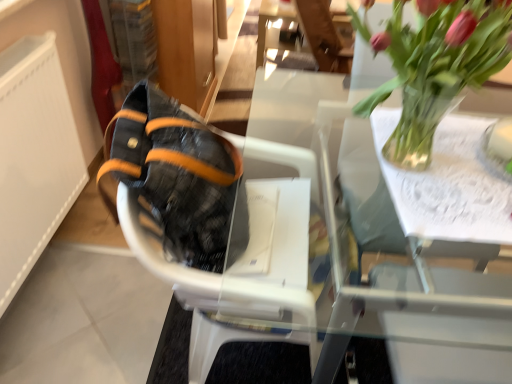
Question: Can we say leather-like black shoe at left lies outside black textured fabric baby carriage at center?

Choices:
 (A) yes
 (B) no

Answer: (B)

Question: Is leather-like black shoe at left to the right of black textured fabric baby carriage at center from the viewer's perspective?

Choices:
 (A) no
 (B) yes

Answer: (A)

Question: Is leather-like black shoe at left next to black textured fabric baby carriage at center?

Choices:
 (A) yes
 (B) no

Answer: (A)

Question: From a real-world perspective, is leather-like black shoe at left located higher than black textured fabric baby carriage at center?

Choices:
 (A) yes
 (B) no

Answer: (A)

Question: Is the depth of leather-like black shoe at left greater than that of black textured fabric baby carriage at center?

Choices:
 (A) yes
 (B) no

Answer: (A)

Question: From a real-world perspective, does leather-like black shoe at left sit lower than black textured fabric baby carriage at center?

Choices:
 (A) yes
 (B) no

Answer: (B)

Question: Is leather-like black shoe at left taller than transparent glass table at upper center?

Choices:
 (A) no
 (B) yes

Answer: (A)

Question: Could you tell me if leather-like black shoe at left is facing transparent glass table at upper center?

Choices:
 (A) no
 (B) yes

Answer: (B)

Question: Are leather-like black shoe at left and transparent glass table at upper center making contact?

Choices:
 (A) yes
 (B) no

Answer: (B)

Question: From the image's perspective, is leather-like black shoe at left above transparent glass table at upper center?

Choices:
 (A) yes
 (B) no

Answer: (A)

Question: Does leather-like black shoe at left have a smaller size compared to transparent glass table at upper center?

Choices:
 (A) yes
 (B) no

Answer: (A)

Question: From a real-world perspective, is leather-like black shoe at left located higher than transparent glass table at upper center?

Choices:
 (A) yes
 (B) no

Answer: (A)

Question: Is leather-like black shoe at left closer to the viewer compared to translucent glass vase at upper right?

Choices:
 (A) yes
 (B) no

Answer: (B)